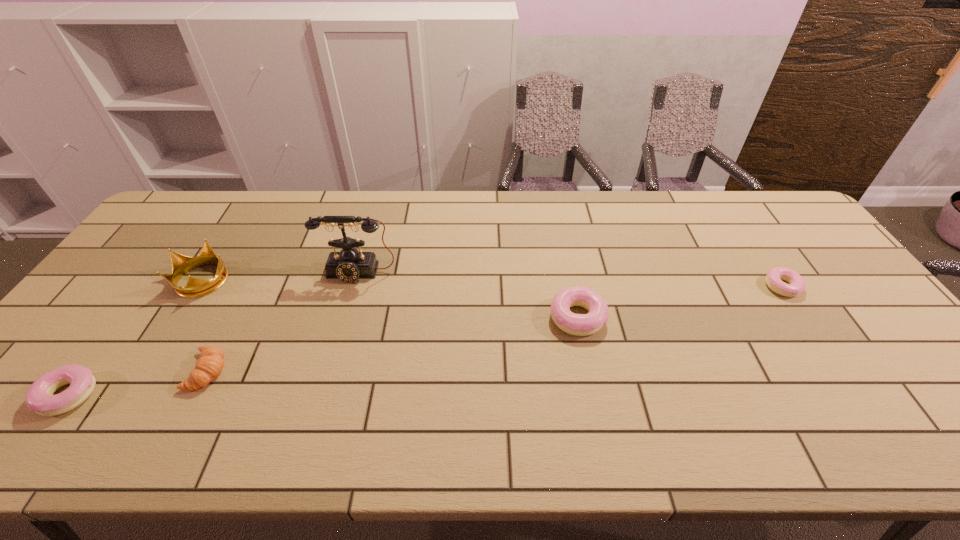
Find the location of a particular element. The height and width of the screenshot is (540, 960). vacant space that satisfies the following two spatial constraints: 1. on the dial of the tallest object; 2. on the left side of the third tallest object is located at coordinates [x=346, y=318].

Locate an element on the screen. free space that satisfies the following two spatial constraints: 1. on the front side of the third object from left to right; 2. on the left side of the crown is located at coordinates click(x=147, y=371).

I want to click on vacant space that satisfies the following two spatial constraints: 1. on the dial of the tallest object; 2. on the left side of the second object from right to left, so click(346, 318).